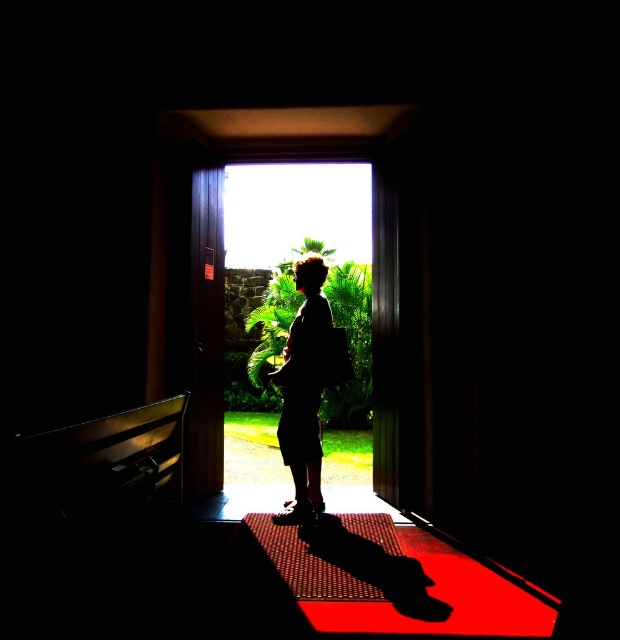
Can you confirm if transparent glass door at center is shorter than silhouette fabric at center?

Indeed, transparent glass door at center has a lesser height compared to silhouette fabric at center.

Between transparent glass door at center and silhouette fabric at center, which one has less height?

With less height is transparent glass door at center.

Measure the distance between transparent glass door at center and camera.

transparent glass door at center is 4.26 meters from camera.

Locate an element on the screen. The width and height of the screenshot is (620, 640). transparent glass door at center is located at coordinates (327, 275).

Is wooden door at center bigger than silhouette fabric at center?

No.

Is wooden door at center taller than silhouette fabric at center?

Indeed, wooden door at center has a greater height compared to silhouette fabric at center.

Locate an element on the screen. The image size is (620, 640). wooden door at center is located at coordinates (206, 336).

Between transparent glass door at center and wooden door at center, which one is positioned higher?

transparent glass door at center is above.

Which of these two, transparent glass door at center or wooden door at center, stands taller?

wooden door at center

At what (x,y) coordinates should I click in order to perform the action: click on transparent glass door at center. Please return your answer as a coordinate pair (x, y). This screenshot has height=640, width=620. Looking at the image, I should click on (327, 275).